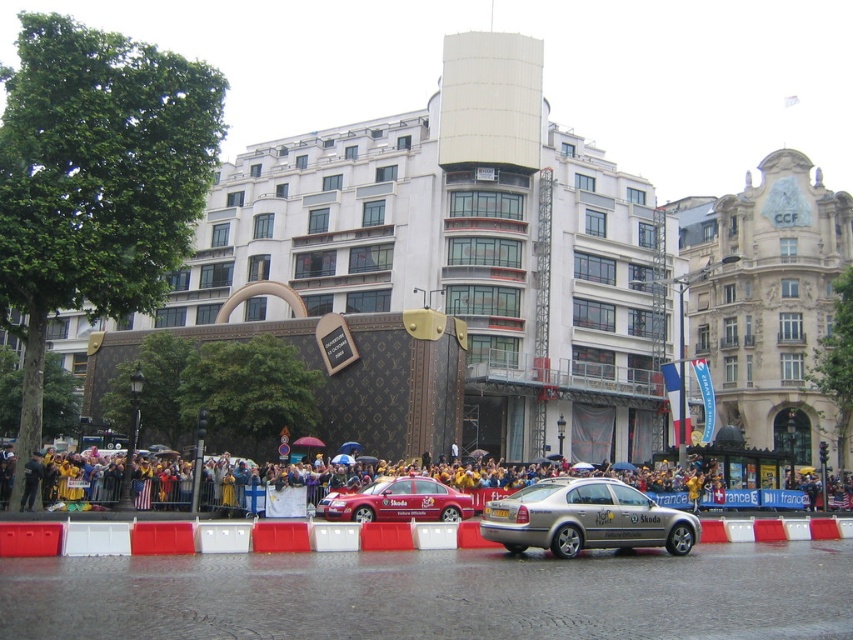
Who is more forward, [553,540] or [460,513]?

Positioned in front is point [553,540].

This screenshot has height=640, width=853. I want to click on silver metallic car at center, so click(x=585, y=518).

Is point (671, 554) less distant than point (447, 497)?

Yes, point (671, 554) is closer to viewer.

At what (x,y) coordinates should I click in order to perform the action: click on silver metallic car at center. Please return your answer as a coordinate pair (x, y). Image resolution: width=853 pixels, height=640 pixels. Looking at the image, I should click on (585, 518).

Can you confirm if yellow fabric crowd at lower center is positioned to the right of silver metallic car at center?

In fact, yellow fabric crowd at lower center is to the left of silver metallic car at center.

Who is more forward, (720,476) or (573,486)?

Point (573,486) is more forward.

Which is in front, point (465, 481) or point (614, 483)?

Point (614, 483)

Identify the location of yellow fabric crowd at lower center. (364, 480).

Which of these two, yellow fabric crowd at lower center or metallic red car at center, stands taller?

Standing taller between the two is yellow fabric crowd at lower center.

Is yellow fabric crowd at lower center to the right of metallic red car at center from the viewer's perspective?

Yes, yellow fabric crowd at lower center is to the right of metallic red car at center.

This screenshot has height=640, width=853. Find the location of `yellow fabric crowd at lower center`. yellow fabric crowd at lower center is located at coordinates (364, 480).

I want to click on yellow fabric crowd at lower center, so click(364, 480).